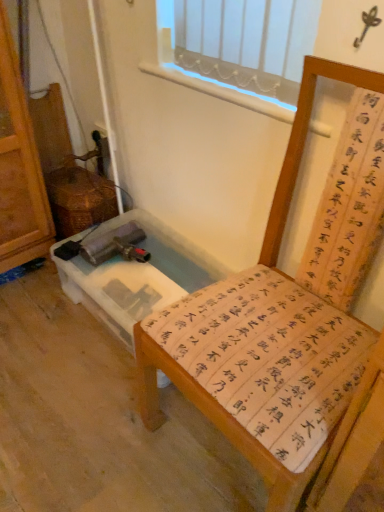
Question: In terms of size, does wooden chair with calligraphy cushion at center appear bigger or smaller than clear plastic vanity at lower left?

Choices:
 (A) small
 (B) big

Answer: (B)

Question: In terms of height, does wooden chair with calligraphy cushion at center look taller or shorter compared to clear plastic vanity at lower left?

Choices:
 (A) tall
 (B) short

Answer: (A)

Question: From the image's perspective, is wooden chair with calligraphy cushion at center above or below clear plastic vanity at lower left?

Choices:
 (A) below
 (B) above

Answer: (A)

Question: Considering the positions of clear plastic vanity at lower left and wooden chair with calligraphy cushion at center in the image, is clear plastic vanity at lower left taller or shorter than wooden chair with calligraphy cushion at center?

Choices:
 (A) short
 (B) tall

Answer: (A)

Question: In terms of width, does clear plastic vanity at lower left look wider or thinner when compared to wooden chair with calligraphy cushion at center?

Choices:
 (A) thin
 (B) wide

Answer: (A)

Question: In the image, is clear plastic vanity at lower left on the left side or the right side of wooden chair with calligraphy cushion at center?

Choices:
 (A) left
 (B) right

Answer: (A)

Question: From a real-world perspective, is clear plastic vanity at lower left above or below wooden chair with calligraphy cushion at center?

Choices:
 (A) above
 (B) below

Answer: (B)